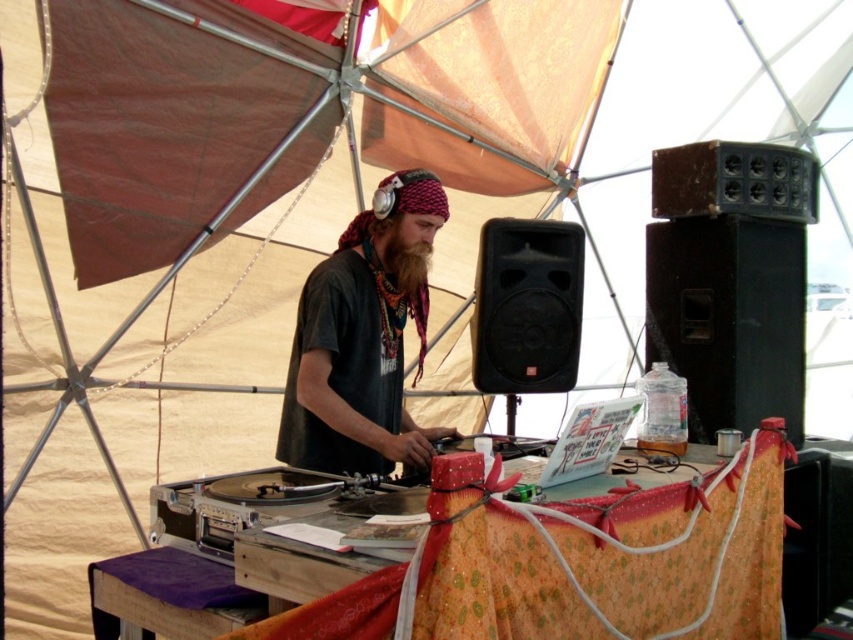
Based on the photo, does black matte shirt at center have a smaller size compared to black matte speaker at center?

Incorrect, black matte shirt at center is not smaller in size than black matte speaker at center.

Is black matte shirt at center further to camera compared to black matte speaker at center?

That is False.

Is point (403, 440) positioned before point (490, 285)?

That is True.

In order to click on black matte shirt at center in this screenshot , I will do click(360, 342).

Is black plastic speaker at right taller than black matte speaker at center?

Indeed, black plastic speaker at right has a greater height compared to black matte speaker at center.

Where is `black plastic speaker at right`? The image size is (853, 640). black plastic speaker at right is located at coordinates (729, 317).

Where is `black plastic speaker at right`? black plastic speaker at right is located at coordinates (729, 317).

Can you confirm if black matte speaker at center is positioned to the right of brown fuzzy beard at center?

Indeed, black matte speaker at center is positioned on the right side of brown fuzzy beard at center.

Can you confirm if black matte speaker at center is bigger than brown fuzzy beard at center?

Correct, black matte speaker at center is larger in size than brown fuzzy beard at center.

Between point (544, 358) and point (393, 280), which one is positioned in front?

Positioned in front is point (393, 280).

The height and width of the screenshot is (640, 853). I want to click on black matte speaker at center, so click(527, 307).